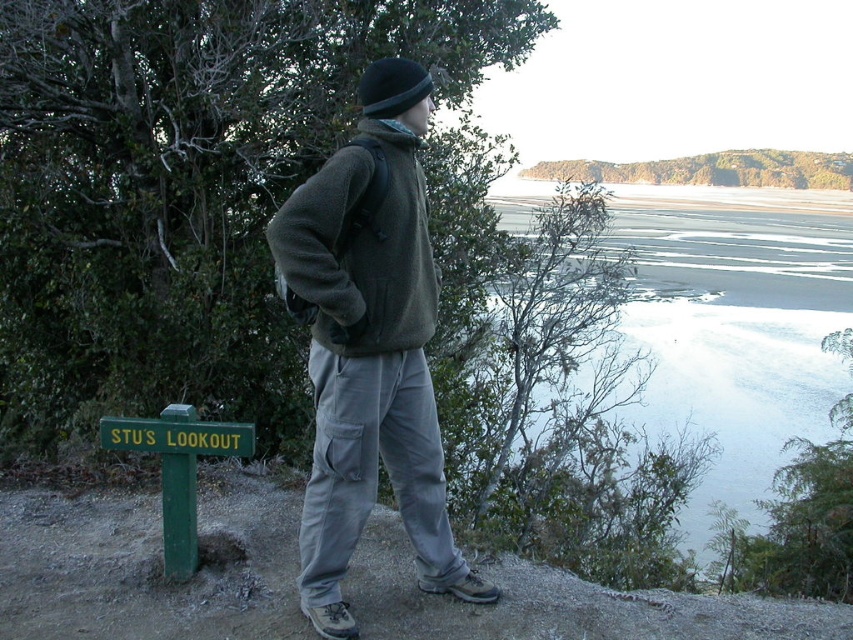
You are a photographer trying to capture the scenic overlook. You notice the fuzzy green jacket at center and the green painted wood sign at lower left. Which object should you focus on first to include both in your shot without moving the camera?

The fuzzy green jacket at center is to the right of the green painted wood sign at lower left. To include both in your shot without moving the camera, focus on the green painted wood sign at lower left first, as it is positioned to the left of the jacket, allowing the frame to encompass both objects.

You are standing at STU S LOOKOUT and want to take a photo of two specific points in the scene. The first point is located at coordinates point (345, 252) and the second point is at point (416, 68). Which point is closer to you?

Point (345, 252) is closer to the viewer than point (416, 68).

You are a photographer trying to capture the scenic overlook. You notice the matte green fleece jacket at center and the black woolen hat at center. Which object should you focus on first if you want to ensure both are in the frame without moving the camera?

The matte green fleece jacket at center is below the black woolen hat at center, so you should focus on the black woolen hat at center first to ensure both are in the frame without moving the camera.